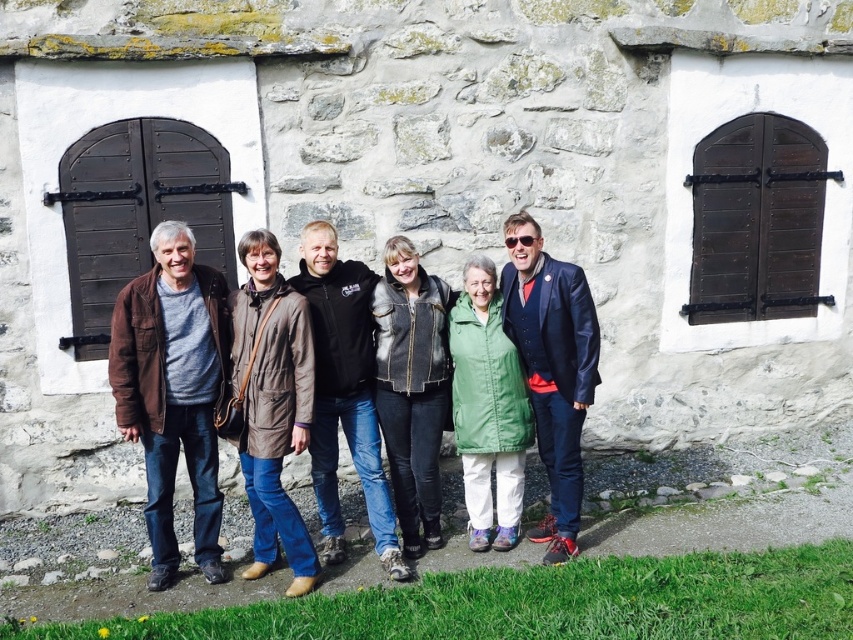
Question: Which of the following is the farthest from the observer?

Choices:
 (A) brown leather jacket at left
 (B) brown leather jacket at center

Answer: (A)

Question: Which point is farther from the camera taking this photo?

Choices:
 (A) (236, 323)
 (B) (177, 339)

Answer: (A)

Question: Is brown leather jacket at center wider than brown leather jacket at left?

Choices:
 (A) no
 (B) yes

Answer: (B)

Question: Does brown leather jacket at center appear on the right side of brown leather jacket at left?

Choices:
 (A) yes
 (B) no

Answer: (A)

Question: Does brown leather jacket at center have a larger size compared to brown leather jacket at left?

Choices:
 (A) yes
 (B) no

Answer: (A)